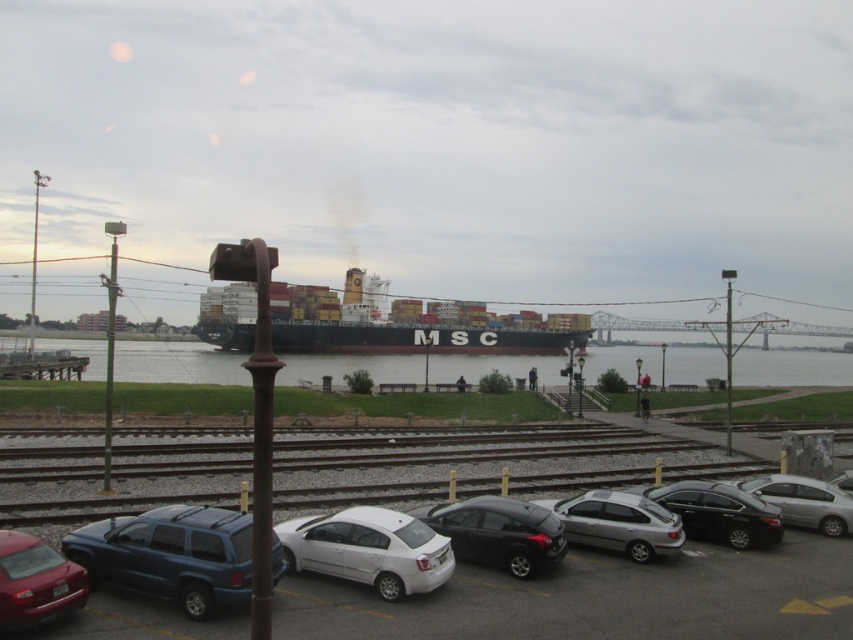
Question: Can you confirm if clear water at center is positioned below white matte hatchback at center?

Choices:
 (A) yes
 (B) no

Answer: (A)

Question: Which of these objects is positioned closest to the shiny black sedan at center?

Choices:
 (A) clear water at center
 (B) black matte cargo ship at center
 (C) metallic silver car at lower center
 (D) shiny black hatchback at center

Answer: (C)

Question: Does metallic silver car at lower center appear over clear water at center?

Choices:
 (A) no
 (B) yes

Answer: (B)

Question: Among these objects, which one is nearest to the camera?

Choices:
 (A) matte blue suv at lower left
 (B) matte red sedan at lower left
 (C) silver metallic sedan at lower right

Answer: (B)

Question: Which object is farther from the camera taking this photo?

Choices:
 (A) shiny black sedan at center
 (B) matte blue suv at lower left
 (C) metallic silver car at lower center
 (D) silver metallic sedan at center

Answer: (A)

Question: Can you confirm if white matte hatchback at center is positioned above shiny black sedan at center?

Choices:
 (A) no
 (B) yes

Answer: (A)